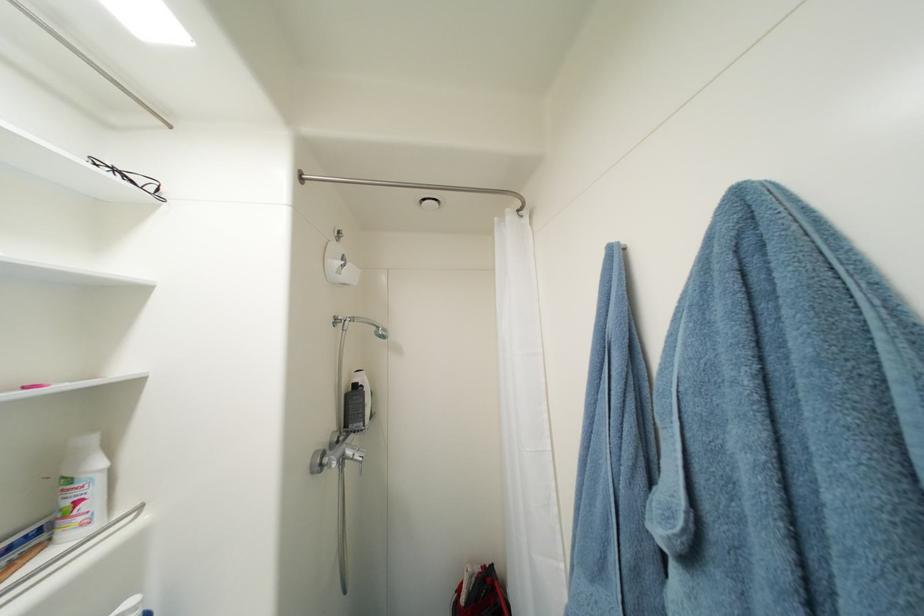
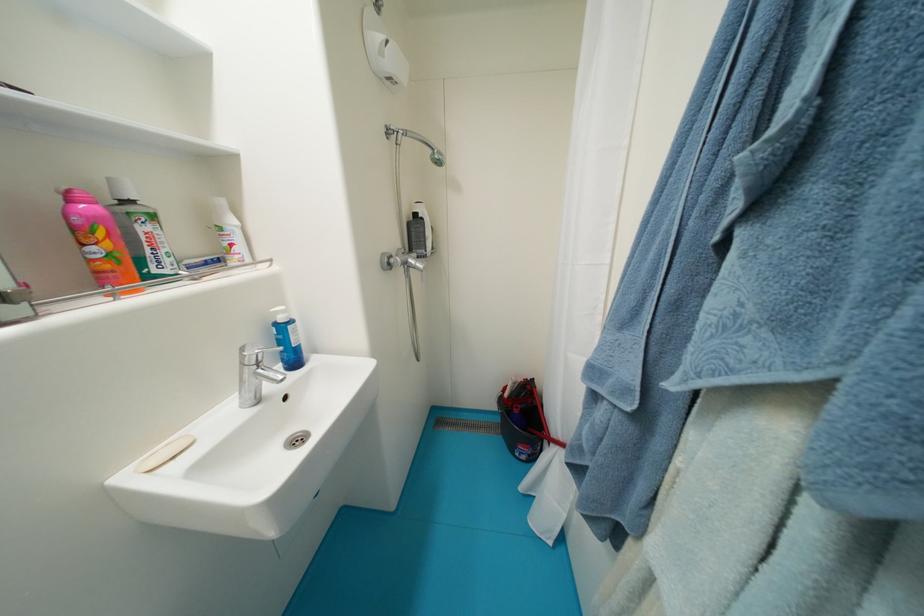
Based on the continuous images, in which direction is the camera rotating?

The camera's rotation is toward left-down.